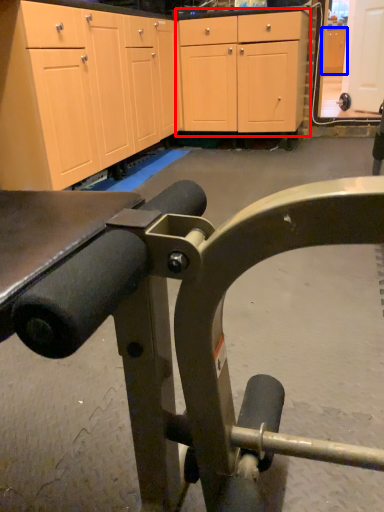
Question: Among these objects, which one is nearest to the camera, cabinetry (highlighted by a red box) or cabinetry (highlighted by a blue box)?

Choices:
 (A) cabinetry
 (B) cabinetry

Answer: (A)